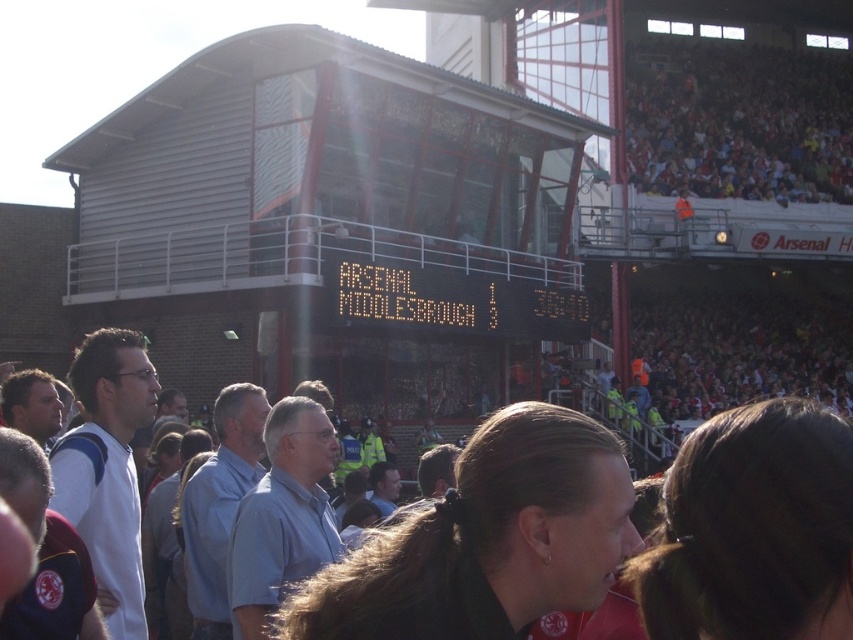
Question: Is red fabric crowd at upper right thinner than orange digital scoreboard at center?

Choices:
 (A) yes
 (B) no

Answer: (B)

Question: Which object is farther from the camera taking this photo?

Choices:
 (A) orange digital scoreboard at center
 (B) red fabric crowd at upper right

Answer: (B)

Question: Which object is closer to the camera taking this photo?

Choices:
 (A) red fabric crowd at upper right
 (B) orange digital scoreboard at center

Answer: (B)

Question: Considering the relative positions of red fabric crowd at upper right and orange digital scoreboard at center in the image provided, where is red fabric crowd at upper right located with respect to orange digital scoreboard at center?

Choices:
 (A) left
 (B) right

Answer: (B)

Question: Can you confirm if red fabric crowd at upper right is bigger than orange digital scoreboard at center?

Choices:
 (A) yes
 (B) no

Answer: (A)